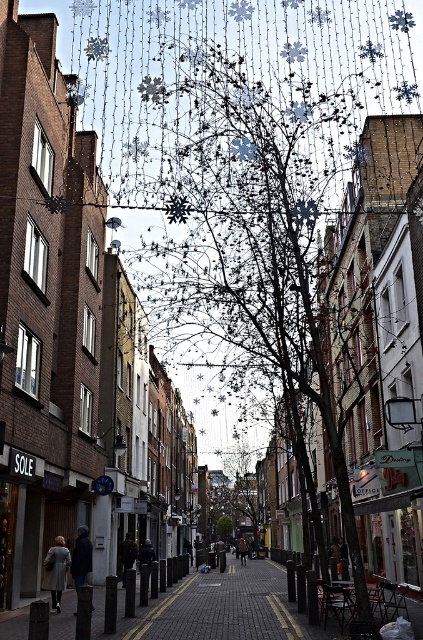
Consider the image. You are a pedestrian standing on the brick pavement at center. You want to walk to the green leafy tree at center. Is the tree located below or above the pavement you are standing on?

The brick pavement at center is above the green leafy tree at center, so the tree is located below the pavement you are standing on.

You are a delivery person standing on the brick pavement at center. You need to deliver a package to the green leafy tree at center. Can you walk straight to it without crossing any obstacles?

The brick pavement at center and green leafy tree at center are 167.12 meters apart. Since the distance is quite large, you can walk straight to the green leafy tree at center but there might be obstacles like buildings or other structures in between that are not mentioned in the scene description. However, according to the given information, there are no obstacles mentioned, so theoretically, you can walk straight.